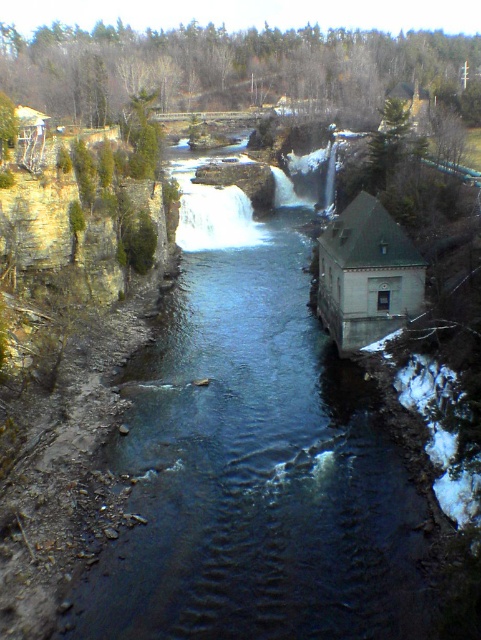
You are standing at the point marked as point (255, 470) in the image. What is the color of the surface you are currently standing on?

The dark blue water at center is located at point (255, 470), so the surface you are standing on is dark blue water.